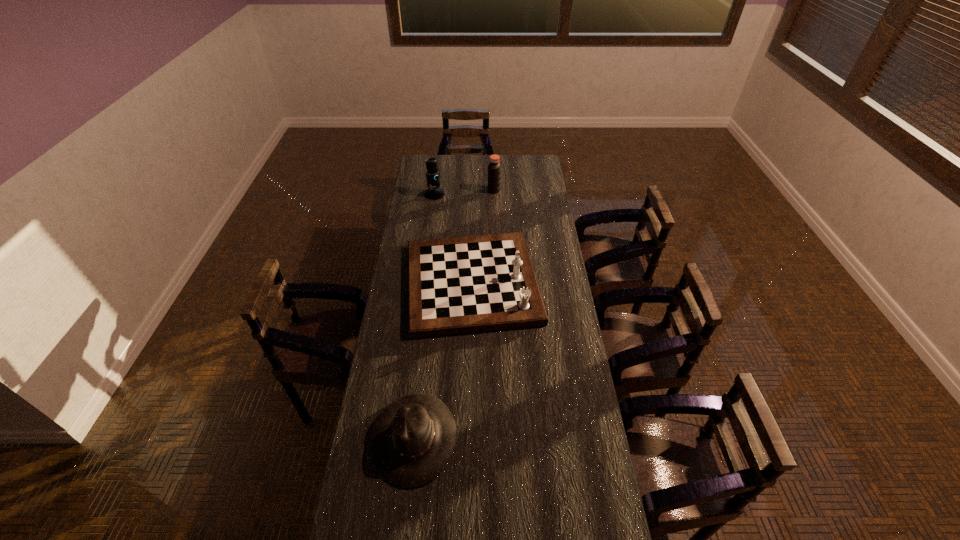
Locate an element on the screen. microphone is located at coordinates (433, 175).

Identify the location of vinegar. (494, 167).

At what (x,y) coordinates should I click in order to perform the action: click on the third farthest object. Please return your answer as a coordinate pair (x, y). Looking at the image, I should click on (456, 285).

Locate an element on the screen. The image size is (960, 540). the nearest object is located at coordinates (412, 440).

Locate an element on the screen. This screenshot has width=960, height=540. hat is located at coordinates (412, 440).

Locate an element on the screen. The height and width of the screenshot is (540, 960). free spot located 0.250m on the back of the microphone is located at coordinates (439, 165).

The width and height of the screenshot is (960, 540). In order to click on blank area located on the left of the vinegar in this screenshot , I will do `click(442, 191)`.

At what (x,y) coordinates should I click in order to perform the action: click on free spot located 0.160m on the back of the second nearest object. Please return your answer as a coordinate pair (x, y). The width and height of the screenshot is (960, 540). Looking at the image, I should click on (473, 218).

What are the coordinates of `vacant space situated on the front-facing side of the nearest object` in the screenshot? It's located at (520, 438).

You are a GUI agent. You are given a task and a screenshot of the screen. Output one action in this format:
    pyautogui.click(x=<x>, y=<y>)
    Task: Click on the microphone positioned at the left edge
    This screenshot has height=540, width=960.
    Given the screenshot: What is the action you would take?
    pyautogui.click(x=433, y=175)